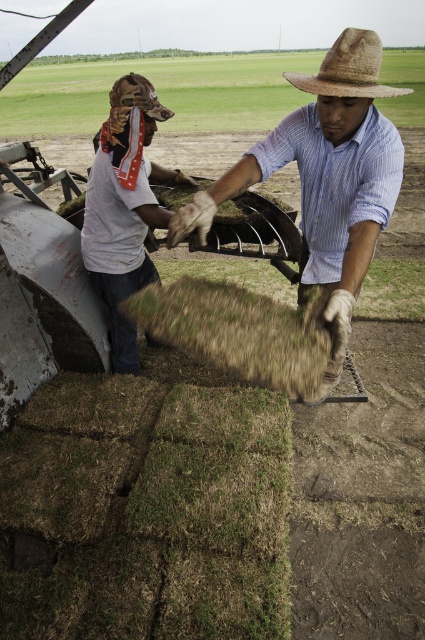
You are standing in the agricultural field and need to locate the brown straw hat at center. Based on the coordinates provided in the Objects Description, can you determine its position relative to the edges of the image?

The brown straw hat at center is located at coordinates point [325,179]. This means it is positioned approximately 28.1 percent from the left edge and 76.7 percent from the top edge of the image.